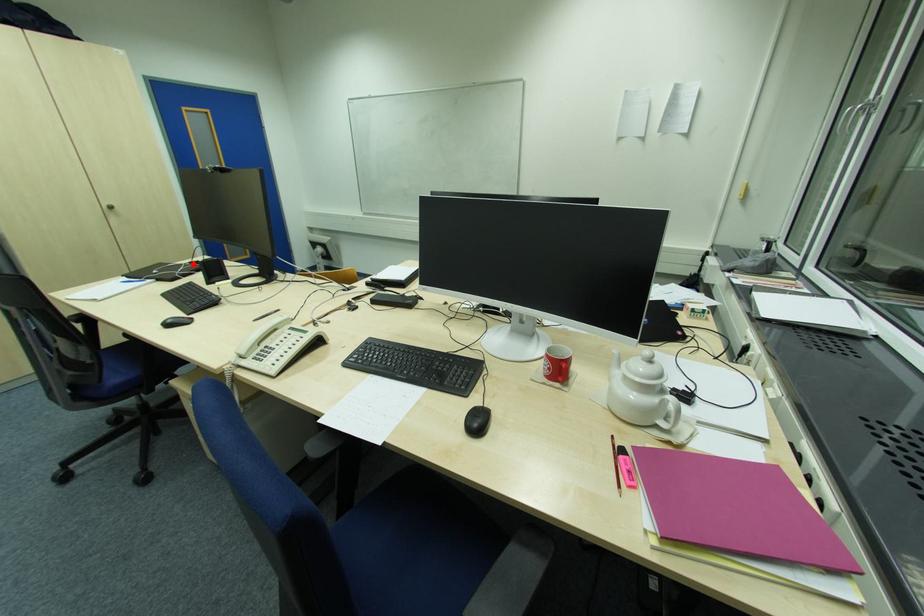
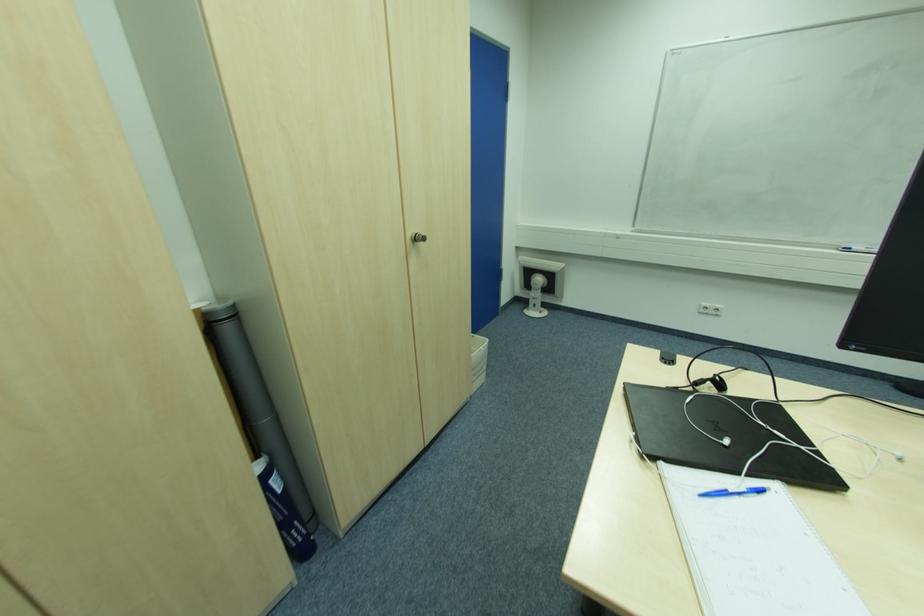
Where in the second image is the point corresponding to the highlighted location from the first image?

(699, 385)